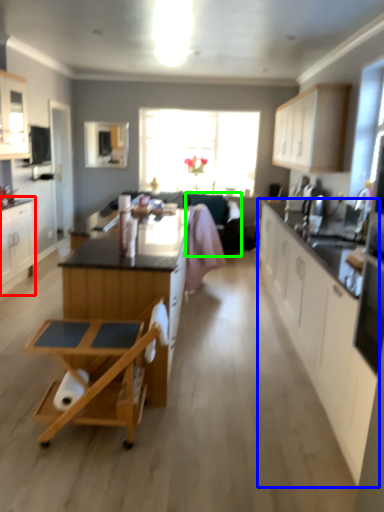
Question: Based on their relative distances, which object is nearer to cabinetry (highlighted by a red box)? Choose from cabinetry (highlighted by a blue box) and armchair (highlighted by a green box).

Choices:
 (A) cabinetry
 (B) armchair

Answer: (B)